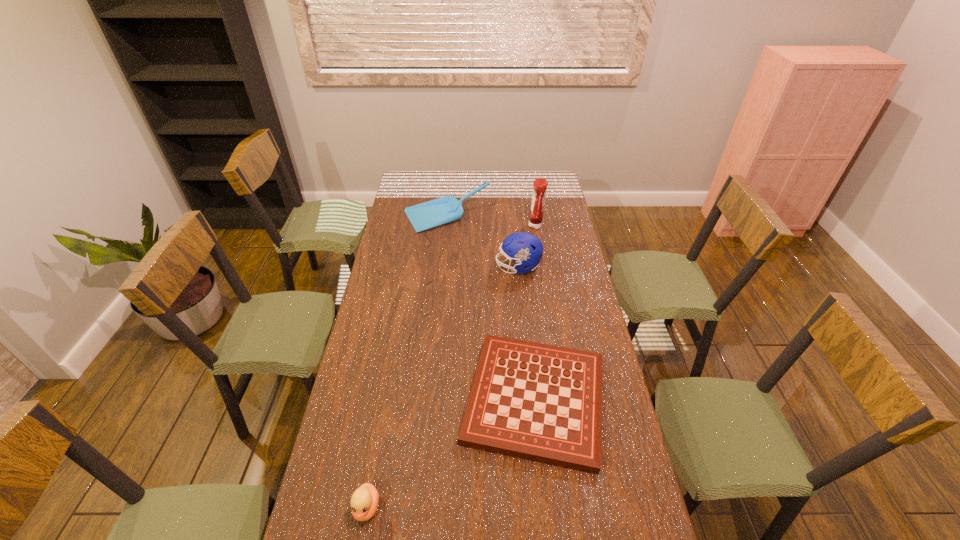
Find the location of a particular element. The width and height of the screenshot is (960, 540). vacant space located 0.150m on the face guard of the football helmet is located at coordinates (462, 267).

Locate an element on the screen. The height and width of the screenshot is (540, 960). free location located 0.250m on the face guard of the football helmet is located at coordinates (439, 267).

Locate an element on the screen. The width and height of the screenshot is (960, 540). vacant area situated 0.220m on the back of the dustpan is located at coordinates (450, 181).

Identify the location of vacant area located 0.390m on the back of the gameboard. Image resolution: width=960 pixels, height=540 pixels. (x=521, y=271).

At what (x,y) coordinates should I click in order to perform the action: click on dustpan situated at the left edge. Please return your answer as a coordinate pair (x, y). This screenshot has width=960, height=540. Looking at the image, I should click on (446, 209).

Identify the location of duckling positioned at the left edge. (364, 502).

You are a GUI agent. You are given a task and a screenshot of the screen. Output one action in this format:
    pyautogui.click(x=<x>, y=<y>)
    Task: Click on the condiment that is at the right edge
    
    Given the screenshot: What is the action you would take?
    pyautogui.click(x=540, y=185)

I want to click on gameboard at the right edge, so click(541, 402).

Image resolution: width=960 pixels, height=540 pixels. In the image, there is a desktop. Identify the location of free space at the far edge. (439, 187).

Where is `free space at the right edge`? The height and width of the screenshot is (540, 960). free space at the right edge is located at coordinates (564, 296).